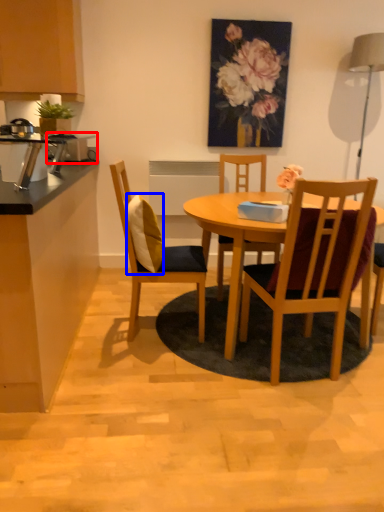
Question: Among these objects, which one is farthest to the camera, appliance (highlighted by a red box) or pillow (highlighted by a blue box)?

Choices:
 (A) appliance
 (B) pillow

Answer: (A)